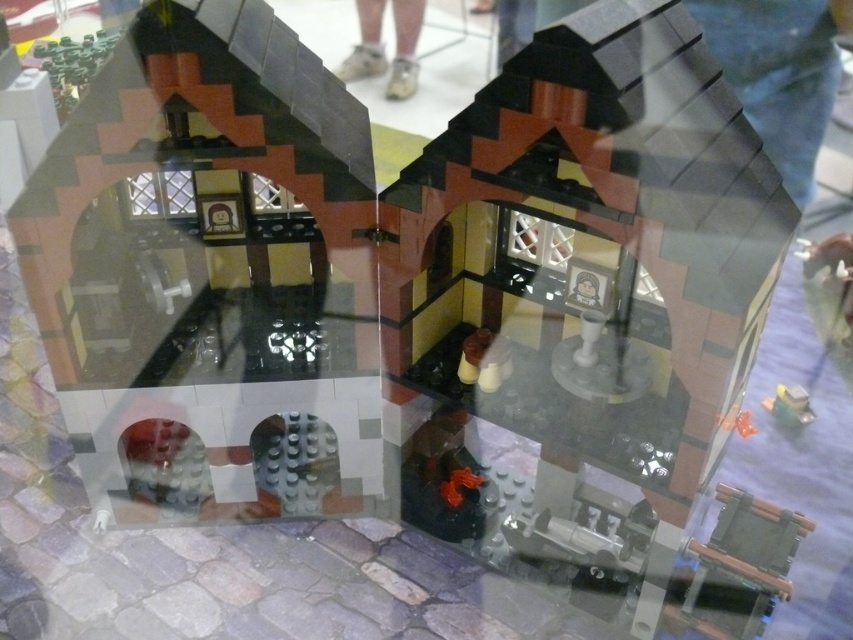
You are a visitor looking at the LEGO model through the glass. You notice the matte brick house at center and the white leather shoes at center. Which object is positioned lower in the scene?

The matte brick house at center is below the white leather shoes at center, so the matte brick house at center is positioned lower in the scene.

You are a visitor standing in front of the LEGO model. You notice the matte black building at center and the white leather shoes at center. From your perspective, which object is positioned to the right?

The white leather shoes at center are to the right of the matte black building at center.

You are a tour guide explaining the LEGO model to visitors. You want to point out two specific points in the scene. The first point is at coordinates point [364,339], and the second is at point [360,22]. Which of these two points is closer to the front of the LEGO model?

Point [364,339] is in front of point [360,22], so the first point is closer to the front of the LEGO model.